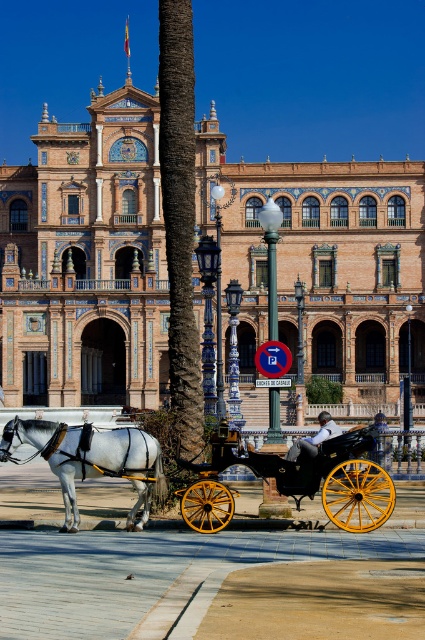
Question: Which object is closer to the camera taking this photo?

Choices:
 (A) wooden polished coach at center
 (B) golden ornate building at center
 (C) shiny gold wheels at center
 (D) white glossy horse at left

Answer: (C)

Question: Does golden ornate building at center appear over shiny gold wheels at center?

Choices:
 (A) no
 (B) yes

Answer: (B)

Question: Which of the following is the closest to the observer?

Choices:
 (A) (365, 440)
 (B) (112, 397)

Answer: (A)

Question: Which point is closer to the camera?

Choices:
 (A) (390, 508)
 (B) (84, 458)

Answer: (A)

Question: Is golden ornate building at center bigger than wooden polished coach at center?

Choices:
 (A) yes
 (B) no

Answer: (A)

Question: Where is golden ornate building at center located in relation to white glossy horse at left in the image?

Choices:
 (A) above
 (B) below

Answer: (A)